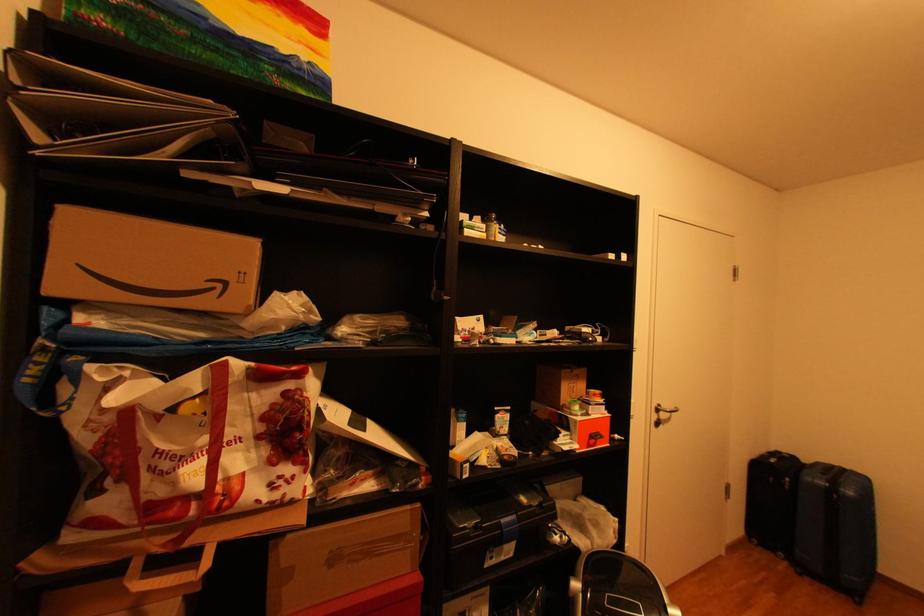
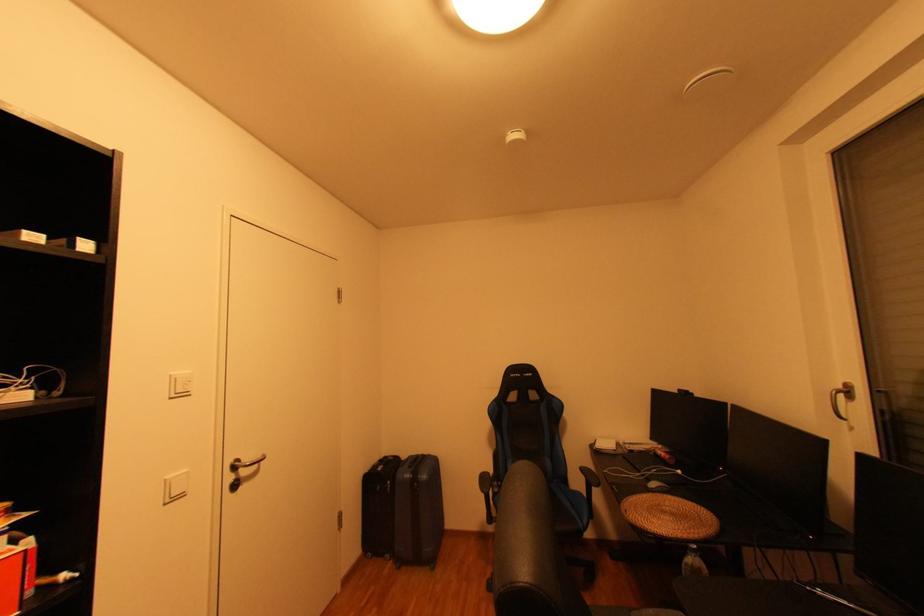
Question: The camera is either moving clockwise (left) or counter-clockwise (right) around the object. The first image is from the beginning of the video and the second image is from the end. Is the camera moving left or right when shooting the video?

Choices:
 (A) Left
 (B) Right

Answer: (A)